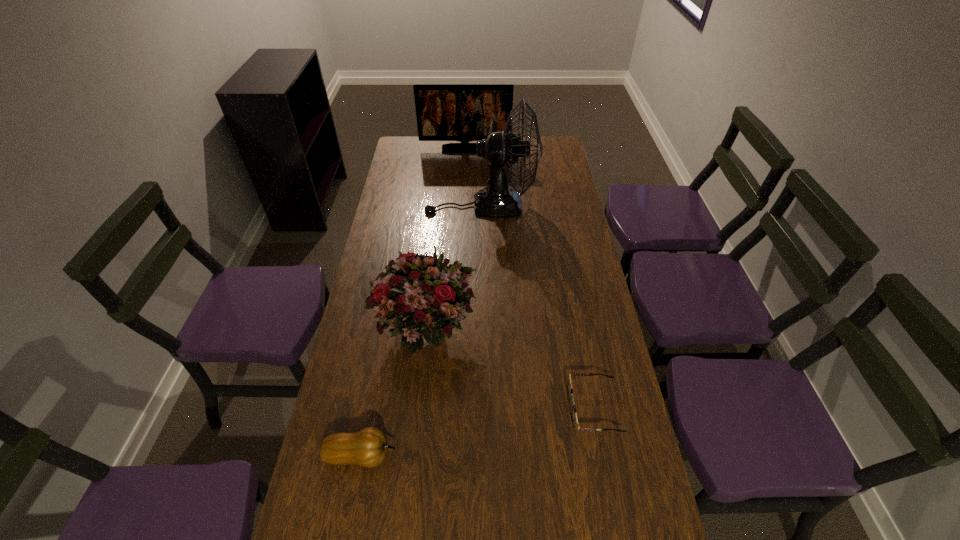
In order to click on free space between the nearest object and the fourth farthest object in this screenshot , I will do (477, 432).

You are a GUI agent. You are given a task and a screenshot of the screen. Output one action in this format:
    pyautogui.click(x=<x>, y=<y>)
    Task: Click on the vacant area that lies between the third farthest object and the monitor
    
    Given the screenshot: What is the action you would take?
    pyautogui.click(x=444, y=241)

Locate an element on the screen. object that stands as the second closest to the second farthest object is located at coordinates (424, 299).

Identify the location of the third closest object to the tallest object. (574, 418).